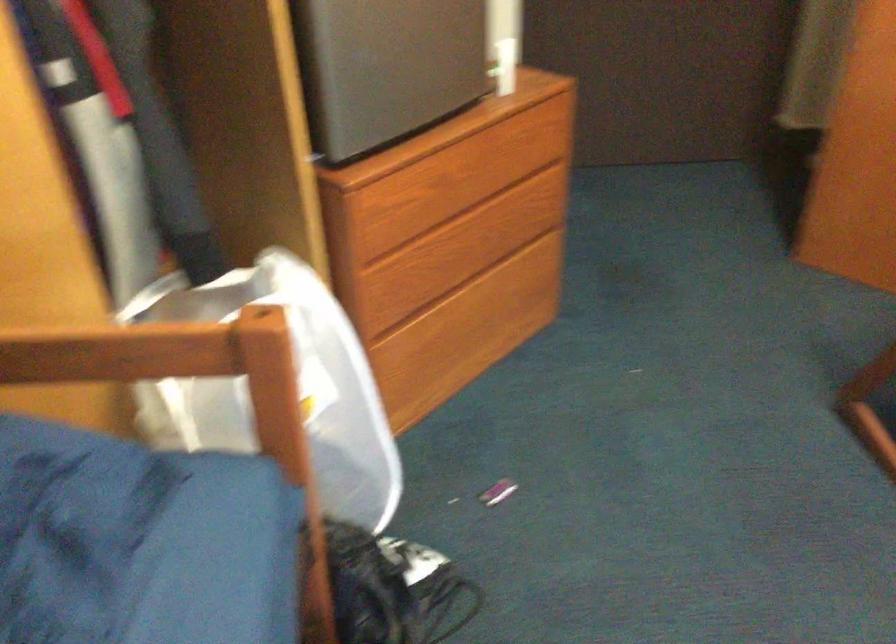
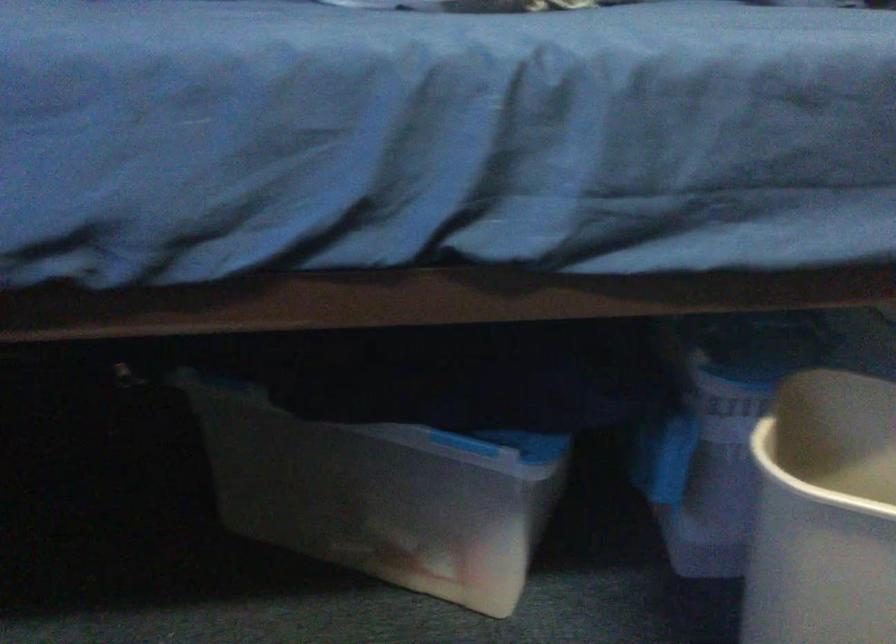
First-person continuous shooting, in which direction is the camera rotating?

The camera rotated toward left-down.